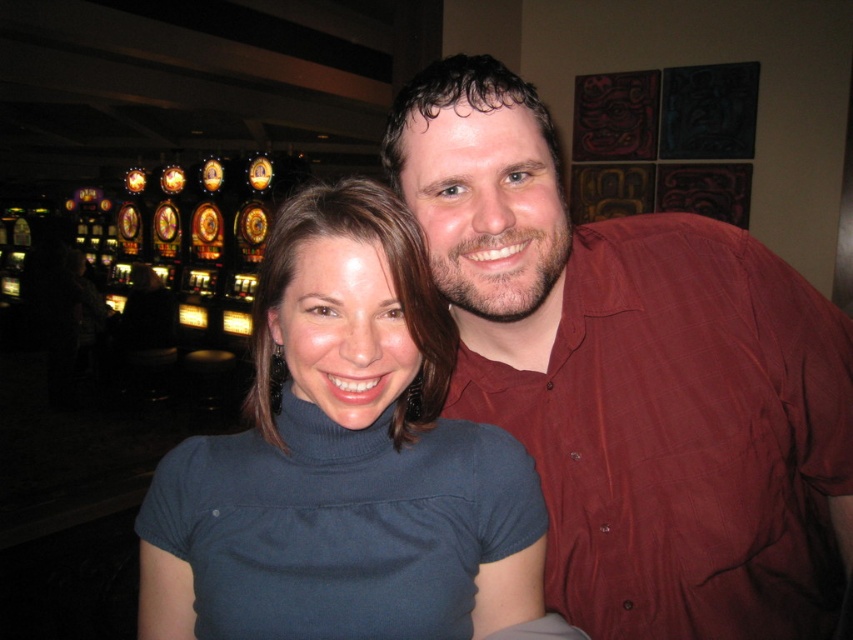
Does matte red shirt at upper right appear on the right side of dark blue turtleneck at center?

Yes, matte red shirt at upper right is to the right of dark blue turtleneck at center.

The height and width of the screenshot is (640, 853). What do you see at coordinates (634, 378) in the screenshot?
I see `matte red shirt at upper right` at bounding box center [634, 378].

Between point (558, 240) and point (340, 241), which one is positioned in front?

Positioned in front is point (340, 241).

This screenshot has width=853, height=640. In order to click on matte red shirt at upper right in this screenshot , I will do `click(634, 378)`.